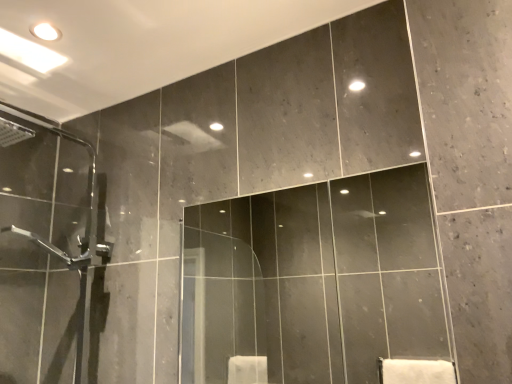
At what (x,y) coordinates should I click in order to perform the action: click on clear glass shower door at left. Please return your answer as a coordinate pair (x, y). The height and width of the screenshot is (384, 512). Looking at the image, I should click on (44, 250).

Describe the element at coordinates (44, 250) in the screenshot. The width and height of the screenshot is (512, 384). I see `clear glass shower door at left` at that location.

At what (x,y) coordinates should I click in order to perform the action: click on matte glass mirror at center. Please return your answer as a coordinate pair (x, y). Looking at the image, I should click on (313, 281).

Describe the element at coordinates (313, 281) in the screenshot. The width and height of the screenshot is (512, 384). I see `matte glass mirror at center` at that location.

Where is `clear glass shower door at left`? clear glass shower door at left is located at coordinates (44, 250).

Can you confirm if matte glass mirror at center is positioned to the right of clear glass shower door at left?

Yes.

Is matte glass mirror at center in front of or behind clear glass shower door at left in the image?

matte glass mirror at center is in front of clear glass shower door at left.

Considering the positions of point (390, 315) and point (30, 285), is point (390, 315) closer or farther from the camera than point (30, 285)?

Point (390, 315) is farther from the camera than point (30, 285).

From the image's perspective, does matte glass mirror at center appear lower than clear glass shower door at left?

Yes, from the image's perspective, matte glass mirror at center is below clear glass shower door at left.

From a real-world perspective, relative to clear glass shower door at left, is matte glass mirror at center vertically above or below?

matte glass mirror at center is below clear glass shower door at left.

Considering the relative sizes of matte glass mirror at center and clear glass shower door at left in the image provided, is matte glass mirror at center thinner than clear glass shower door at left?

Yes, matte glass mirror at center is thinner than clear glass shower door at left.

Is matte glass mirror at center taller or shorter than clear glass shower door at left?

Clearly, matte glass mirror at center is shorter compared to clear glass shower door at left.

Based on the photo, considering the sizes of objects matte glass mirror at center and clear glass shower door at left in the image provided, who is smaller, matte glass mirror at center or clear glass shower door at left?

matte glass mirror at center.

Is clear glass shower door at left inside matte glass mirror at center?

No, clear glass shower door at left is not inside matte glass mirror at center.

From the picture: Is matte glass mirror at center in contact with clear glass shower door at left?

No, matte glass mirror at center is not in contact with clear glass shower door at left.

Is matte glass mirror at center oriented away from clear glass shower door at left?

No, matte glass mirror at center is not facing away from clear glass shower door at left.

How much distance is there between matte glass mirror at center and clear glass shower door at left?

matte glass mirror at center and clear glass shower door at left are 1.15 meters apart from each other.

Find the location of a particular element. The height and width of the screenshot is (384, 512). mirror beneath the clear glass shower door at left (from a real-world perspective) is located at coordinates (313, 281).

Is clear glass shower door at left at the left side of matte glass mirror at center?

Yes, clear glass shower door at left is to the left of matte glass mirror at center.

Which object is further away from the camera, clear glass shower door at left or matte glass mirror at center?

clear glass shower door at left.

Between point (61, 301) and point (395, 302), which one is positioned behind?

Point (395, 302)

From the image's perspective, does clear glass shower door at left appear lower than matte glass mirror at center?

No, from the image's perspective, clear glass shower door at left is not below matte glass mirror at center.

From a real-world perspective, which is physically above, clear glass shower door at left or matte glass mirror at center?

clear glass shower door at left.

From the picture: Considering the sizes of clear glass shower door at left and matte glass mirror at center in the image, is clear glass shower door at left wider or thinner than matte glass mirror at center?

clear glass shower door at left is wider than matte glass mirror at center.

Can you confirm if clear glass shower door at left is taller than matte glass mirror at center?

Correct, clear glass shower door at left is much taller as matte glass mirror at center.

Considering the sizes of clear glass shower door at left and matte glass mirror at center in the image, is clear glass shower door at left bigger or smaller than matte glass mirror at center?

Considering their sizes, clear glass shower door at left takes up more space than matte glass mirror at center.

Is matte glass mirror at center inside clear glass shower door at left?

No, clear glass shower door at left does not contain matte glass mirror at center.

Are clear glass shower door at left and matte glass mirror at center far apart?

Yes, clear glass shower door at left and matte glass mirror at center are located far from each other.

Is clear glass shower door at left positioned with its back to matte glass mirror at center?

No, matte glass mirror at center is not at the back of clear glass shower door at left.

You are a GUI agent. You are given a task and a screenshot of the screen. Output one action in this format:
    pyautogui.click(x=<x>, y=<y>)
    Task: Click on the mirror that is on the right side of clear glass shower door at left
    This screenshot has width=512, height=384.
    Given the screenshot: What is the action you would take?
    pyautogui.click(x=313, y=281)

Find the location of a particular element. screen door to the left of matte glass mirror at center is located at coordinates (44, 250).

You are a GUI agent. You are given a task and a screenshot of the screen. Output one action in this format:
    pyautogui.click(x=<x>, y=<y>)
    Task: Click on the screen door that is behind the matte glass mirror at center
    This screenshot has width=512, height=384.
    Given the screenshot: What is the action you would take?
    pyautogui.click(x=44, y=250)